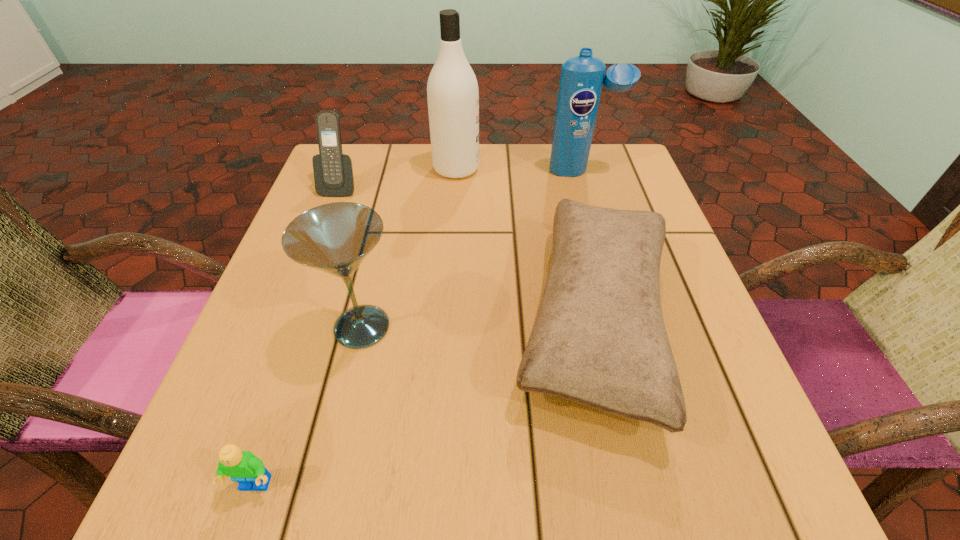
At what (x,y) coordinates should I click in order to perform the action: click on the taller shampoo. Please return your answer as a coordinate pair (x, y). The width and height of the screenshot is (960, 540). Looking at the image, I should click on (452, 89).

Identify the location of the fourth object from left to right. (452, 89).

Identify the location of the right shampoo. The width and height of the screenshot is (960, 540). (582, 77).

You are a GUI agent. You are given a task and a screenshot of the screen. Output one action in this format:
    pyautogui.click(x=<x>, y=<y>)
    Task: Click on the shorter shampoo
    This screenshot has width=960, height=540.
    Given the screenshot: What is the action you would take?
    pyautogui.click(x=582, y=77)

This screenshot has height=540, width=960. Find the location of `the third tallest object`. the third tallest object is located at coordinates (335, 238).

Locate an element on the screen. This screenshot has width=960, height=540. the fourth tallest object is located at coordinates (333, 171).

Identify the location of the second shortest object. The image size is (960, 540). (599, 339).

Find the location of a particular element. the shortest object is located at coordinates (244, 467).

What are the coordinates of `Lego` in the screenshot? It's located at (244, 467).

Image resolution: width=960 pixels, height=540 pixels. Find the location of `free region located 0.340m on the front-facing side of the fourth object from left to right`. free region located 0.340m on the front-facing side of the fourth object from left to right is located at coordinates (619, 168).